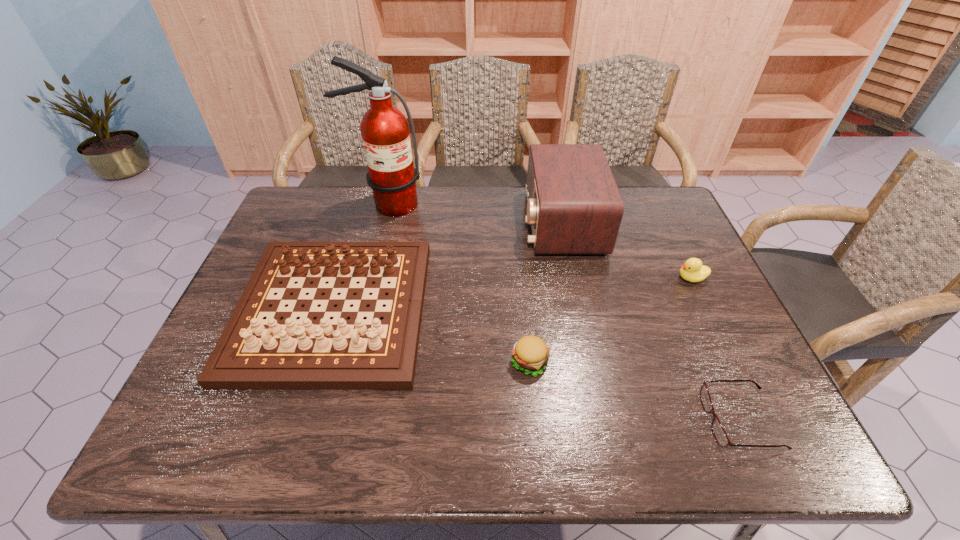
Image resolution: width=960 pixels, height=540 pixels. I want to click on fire extinguisher, so click(x=385, y=133).

What are the coordinates of `the fifth shortest object` in the screenshot? It's located at (574, 206).

Where is `gameboard`? Image resolution: width=960 pixels, height=540 pixels. gameboard is located at coordinates (251, 353).

This screenshot has height=540, width=960. What are the coordinates of `duckling` in the screenshot? It's located at (692, 270).

Identify the location of hamburger. (530, 354).

The image size is (960, 540). I want to click on the shortest object, so click(x=720, y=435).

Identify the location of vacant space located on the nozzle and handle of the fire extinguisher. The height and width of the screenshot is (540, 960). (372, 261).

You are a GUI agent. You are given a task and a screenshot of the screen. Output one action in this format:
    pyautogui.click(x=<x>, y=<y>)
    Task: Click on the vacant space situated on the front panel of the radio receiver
    The width and height of the screenshot is (960, 540).
    Given the screenshot: What is the action you would take?
    pyautogui.click(x=489, y=223)

Where is `free region located 0.320m on the front panel of the radio receiver`? This screenshot has height=540, width=960. free region located 0.320m on the front panel of the radio receiver is located at coordinates 423,223.

Locate an element on the screen. This screenshot has width=960, height=540. vacant region located 0.160m on the front panel of the radio receiver is located at coordinates (473, 223).